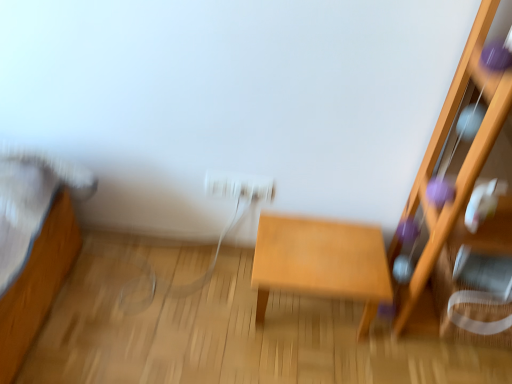
Question: Considering the positions of wooden shelf at right and white glossy electric outlet at center in the image, is wooden shelf at right bigger or smaller than white glossy electric outlet at center?

Choices:
 (A) big
 (B) small

Answer: (A)

Question: In the image, is wooden shelf at right on the left side or the right side of white glossy electric outlet at center?

Choices:
 (A) right
 (B) left

Answer: (A)

Question: Which object is positioned closest to the light brown wooden table at center?

Choices:
 (A) white glossy electric outlet at center
 (B) wooden shelf at right

Answer: (A)

Question: Considering the real-world distances, which object is farthest from the white glossy electric outlet at center?

Choices:
 (A) light brown wooden table at center
 (B) wooden shelf at right

Answer: (B)